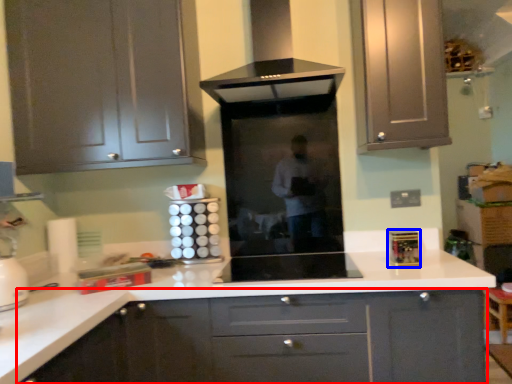
Question: Which object appears closest to the camera in this image, cabinetry (highlighted by a red box) or appliance (highlighted by a blue box)?

Choices:
 (A) cabinetry
 (B) appliance

Answer: (A)